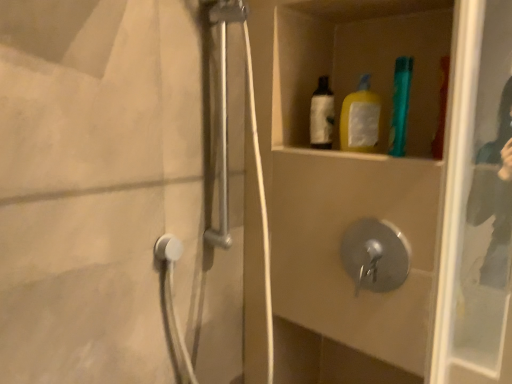
Question: Is transparent glass screen door at upper right located outside teal plastic toothbrush at upper right?

Choices:
 (A) yes
 (B) no

Answer: (A)

Question: Is transparent glass screen door at upper right thinner than teal plastic toothbrush at upper right?

Choices:
 (A) no
 (B) yes

Answer: (A)

Question: Does transparent glass screen door at upper right appear on the left side of teal plastic toothbrush at upper right?

Choices:
 (A) no
 (B) yes

Answer: (B)

Question: Does transparent glass screen door at upper right have a lesser height compared to teal plastic toothbrush at upper right?

Choices:
 (A) no
 (B) yes

Answer: (A)

Question: Is transparent glass screen door at upper right positioned with its back to teal plastic toothbrush at upper right?

Choices:
 (A) yes
 (B) no

Answer: (B)

Question: Based on their positions, is transparent glass screen door at upper right located to the left or right of teal plastic toothbrush at upper right?

Choices:
 (A) left
 (B) right

Answer: (A)

Question: Considering the positions of transparent glass screen door at upper right and teal plastic toothbrush at upper right in the image, is transparent glass screen door at upper right wider or thinner than teal plastic toothbrush at upper right?

Choices:
 (A) thin
 (B) wide

Answer: (B)

Question: From the image's perspective, relative to teal plastic toothbrush at upper right, is transparent glass screen door at upper right above or below?

Choices:
 (A) below
 (B) above

Answer: (A)

Question: Is transparent glass screen door at upper right taller or shorter than teal plastic toothbrush at upper right?

Choices:
 (A) short
 (B) tall

Answer: (B)

Question: Would you say transparent glass screen door at upper right is inside or outside metallic silver shower door at left?

Choices:
 (A) inside
 (B) outside

Answer: (B)

Question: Would you say transparent glass screen door at upper right is to the left or to the right of metallic silver shower door at left in the picture?

Choices:
 (A) right
 (B) left

Answer: (A)

Question: From the image's perspective, is transparent glass screen door at upper right positioned above or below metallic silver shower door at left?

Choices:
 (A) above
 (B) below

Answer: (B)

Question: From a real-world perspective, is transparent glass screen door at upper right above or below metallic silver shower door at left?

Choices:
 (A) below
 (B) above

Answer: (B)

Question: Looking at their shapes, would you say metallic silver shower door at left is wider or thinner than teal plastic toothbrush at upper right?

Choices:
 (A) thin
 (B) wide

Answer: (B)

Question: Does point (260, 190) appear closer or farther from the camera than point (399, 72)?

Choices:
 (A) closer
 (B) farther

Answer: (B)